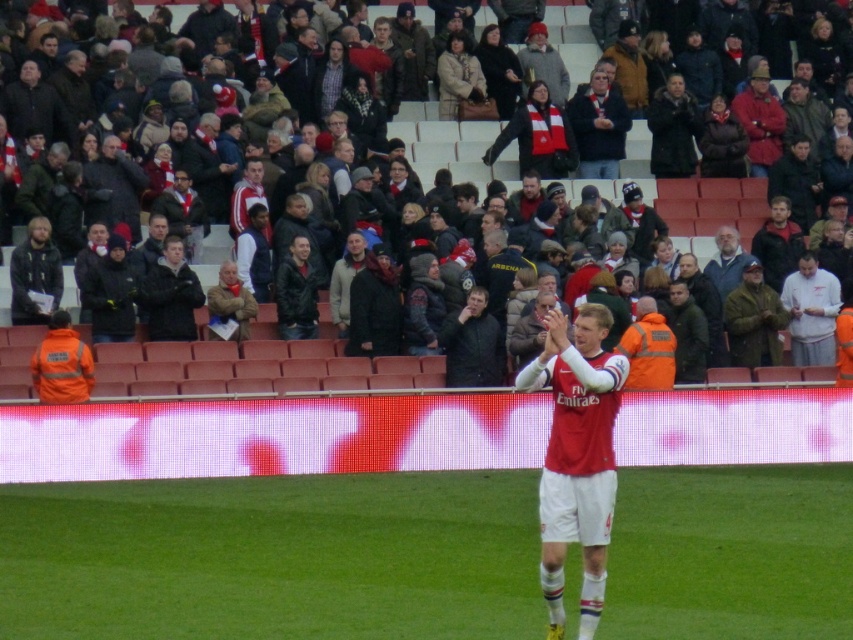
Question: Considering the real-world distances, which object is closest to the matte black jacket at left?

Choices:
 (A) green grass at center
 (B) white fabric shirt at right
 (C) dark gray jacket at upper center

Answer: (C)

Question: Is matte red jersey at center smaller than dark gray jacket at upper center?

Choices:
 (A) yes
 (B) no

Answer: (A)

Question: Does green grass at center appear under matte black jacket at left?

Choices:
 (A) yes
 (B) no

Answer: (A)

Question: Is matte red jersey at center to the right of dark gray jacket at upper center from the viewer's perspective?

Choices:
 (A) no
 (B) yes

Answer: (B)

Question: Which of the following is the farthest from the observer?

Choices:
 (A) dark gray jacket at upper center
 (B) matte black jacket at left
 (C) white fabric shirt at right

Answer: (C)

Question: Among these objects, which one is farthest from the camera?

Choices:
 (A) green grass at center
 (B) matte red jersey at center
 (C) matte black jacket at left

Answer: (C)